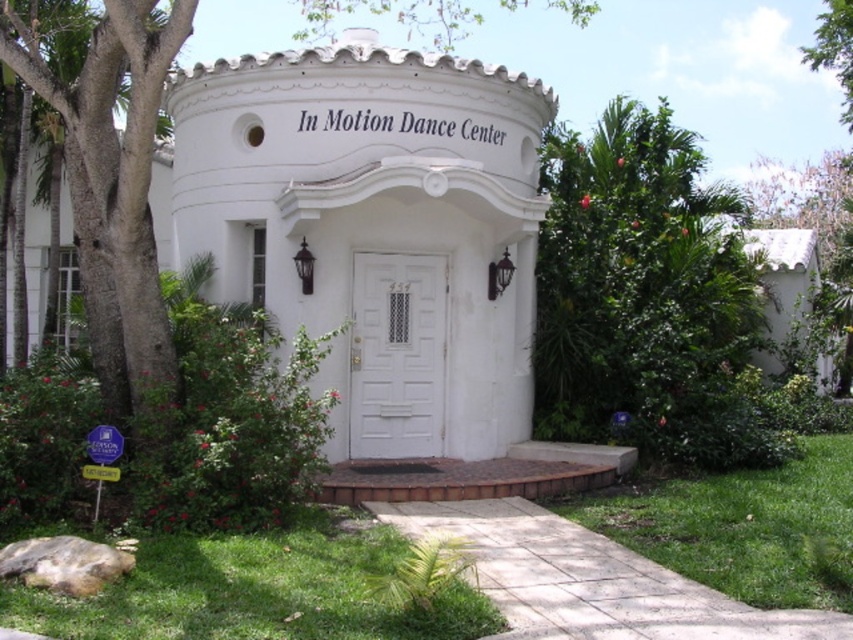
You are standing at the entrance of In Motion Dance Center and want to determine which of the two points, point (312,304) or point (358,266), is closer to you. Based on the scene description, which point is nearer?

Point (312,304) is closer to the viewer than point (358,266).

You are a visitor arriving at the In Motion Dance Center and notice the green leafy tree at center and the white wooden door at center. Which object is positioned higher from the ground?

The green leafy tree at center is located above the white wooden door at center, so it is positioned higher from the ground.